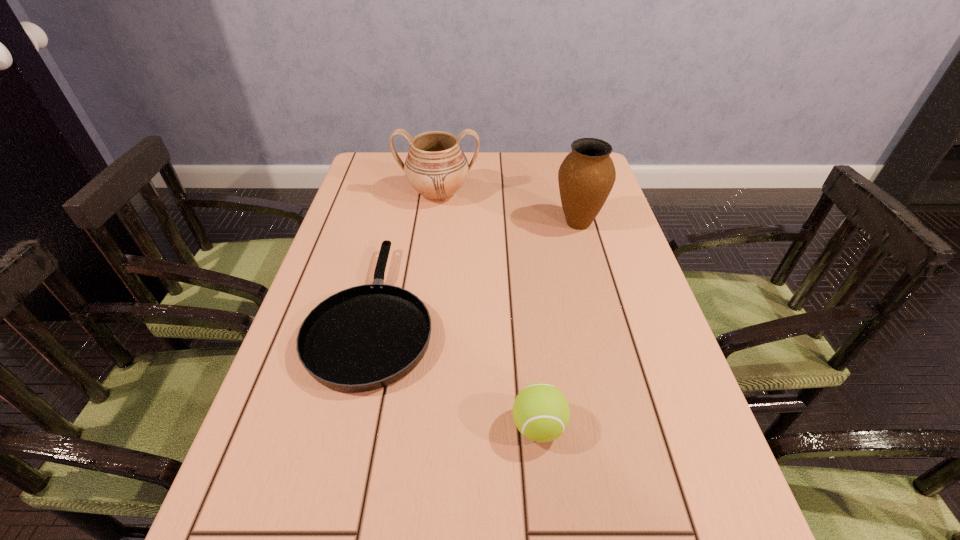
Locate which object is the third closest to the right urn. Please provide its 2D coordinates. Your answer should be formatted as a tuple, i.e. [(x, y)], where the tuple contains the x and y coordinates of a point satisfying the conditions above.

[(541, 413)]

Find the location of a particular element. the third closest object to the second nearest object is located at coordinates (586, 176).

At what (x,y) coordinates should I click in order to perform the action: click on vacant space that satisfies the following two spatial constraints: 1. on the front-facing side of the left urn; 2. on the left side of the nearest object. Please return your answer as a coordinate pair (x, y). The width and height of the screenshot is (960, 540). Looking at the image, I should click on (409, 427).

This screenshot has height=540, width=960. I want to click on free space that satisfies the following two spatial constraints: 1. on the front-facing side of the right urn; 2. on the right side of the left urn, so click(x=435, y=223).

Find the location of a particular element. This screenshot has width=960, height=540. vacant space that satisfies the following two spatial constraints: 1. on the front-facing side of the rightmost object; 2. on the left side of the left urn is located at coordinates (435, 223).

At what (x,y) coordinates should I click in order to perform the action: click on free spot that satisfies the following two spatial constraints: 1. on the front-facing side of the left urn; 2. on the left side of the rightmost object. Please return your answer as a coordinate pair (x, y). The image size is (960, 540). Looking at the image, I should click on (435, 223).

This screenshot has height=540, width=960. Find the location of `free space in the image that satisfies the following two spatial constraints: 1. on the front-facing side of the left urn; 2. on the left side of the right urn`. free space in the image that satisfies the following two spatial constraints: 1. on the front-facing side of the left urn; 2. on the left side of the right urn is located at coordinates click(x=435, y=223).